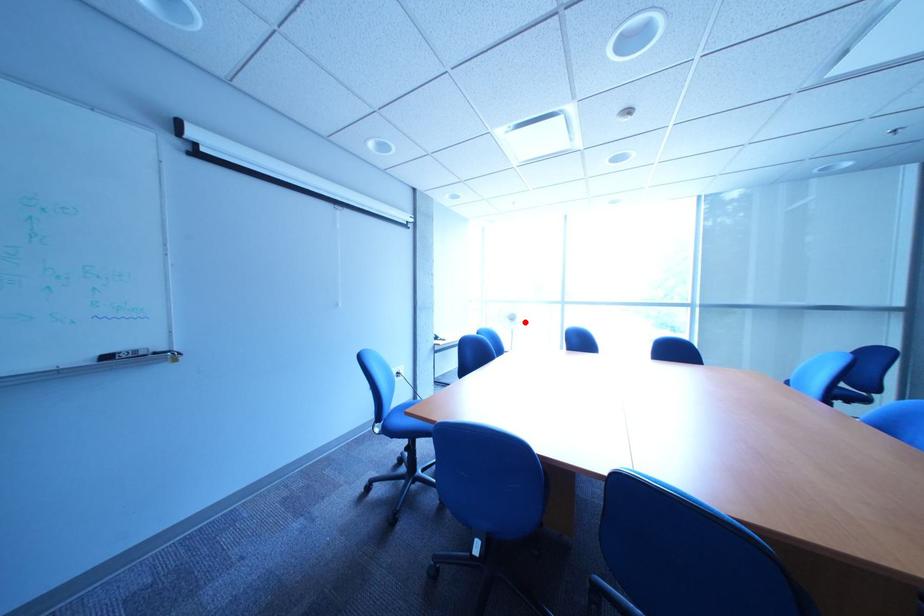
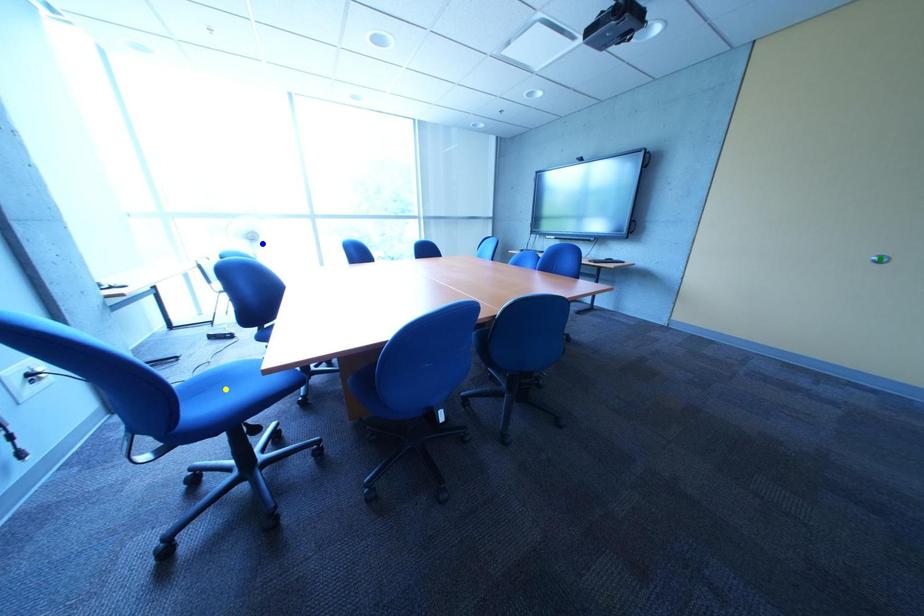
Question: I am providing you with two images of the same scene from different viewpoints. A red point is marked on the first image. You are given multiple points on the second image. In image 2, which mark is for the same physical point as the one in image 1?

Choices:
 (A) yellow point
 (B) blue point
 (C) green point

Answer: (B)